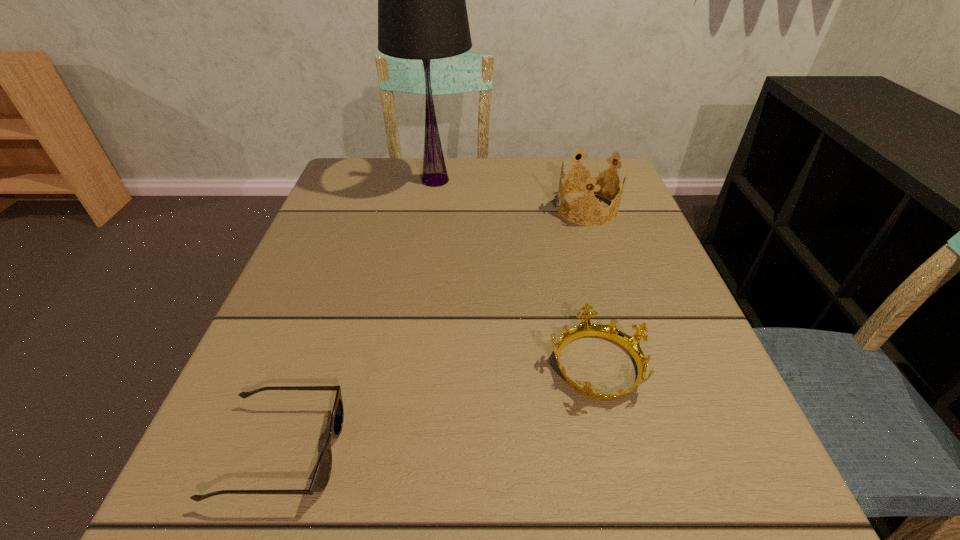
The image size is (960, 540). Find the location of `vacant space that satisfies the following two spatial constraints: 1. on the front side of the second shortest object; 2. on the front lenses of the shortest object`. vacant space that satisfies the following two spatial constraints: 1. on the front side of the second shortest object; 2. on the front lenses of the shortest object is located at coordinates (616, 451).

At what (x,y) coordinates should I click in order to perform the action: click on vacant position in the image that satisfies the following two spatial constraints: 1. on the front-facing side of the lampshade; 2. on the right side of the third tallest object. Please return your answer as a coordinate pair (x, y). Looking at the image, I should click on (408, 364).

The height and width of the screenshot is (540, 960). Find the location of `free point that satisfies the following two spatial constraints: 1. on the front-facing side of the nearer crown; 2. on the right side of the tallest object`. free point that satisfies the following two spatial constraints: 1. on the front-facing side of the nearer crown; 2. on the right side of the tallest object is located at coordinates tap(408, 364).

Identify the location of free region that satisfies the following two spatial constraints: 1. on the front-facing side of the second tallest object; 2. on the left side of the lampshade. The image size is (960, 540). (431, 208).

Where is `free spot that satisfies the following two spatial constraints: 1. on the front-facing side of the taller crown; 2. on the right side of the tallest object`? free spot that satisfies the following two spatial constraints: 1. on the front-facing side of the taller crown; 2. on the right side of the tallest object is located at coordinates (431, 208).

The height and width of the screenshot is (540, 960). Find the location of `vacant area in the image that satisfies the following two spatial constraints: 1. on the front-facing side of the farther crown; 2. on the left side of the tallest object`. vacant area in the image that satisfies the following two spatial constraints: 1. on the front-facing side of the farther crown; 2. on the left side of the tallest object is located at coordinates (431, 208).

Identify the location of free location that satisfies the following two spatial constraints: 1. on the front side of the third tallest object; 2. on the front lenses of the shortest object. (616, 451).

This screenshot has width=960, height=540. What are the coordinates of `vacant region that satisfies the following two spatial constraints: 1. on the front-facing side of the tallest object; 2. on the right side of the farther crown` in the screenshot? It's located at 431,208.